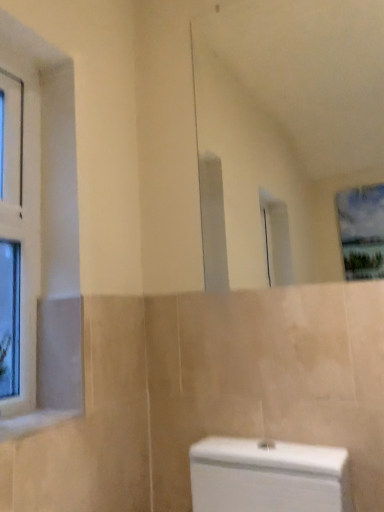
Question: Considering the positions of clear glass window at left and white glossy mirror at upper center in the image, is clear glass window at left bigger or smaller than white glossy mirror at upper center?

Choices:
 (A) big
 (B) small

Answer: (B)

Question: In terms of width, does clear glass window at left look wider or thinner when compared to white glossy mirror at upper center?

Choices:
 (A) wide
 (B) thin

Answer: (B)

Question: Based on their relative distances, which object is nearer to the white glossy mirror at upper center?

Choices:
 (A) white marble window sill at lower left
 (B) clear glass window at left

Answer: (B)

Question: Based on their relative distances, which object is farther from the clear glass window at left?

Choices:
 (A) white marble window sill at lower left
 (B) white glossy mirror at upper center

Answer: (B)